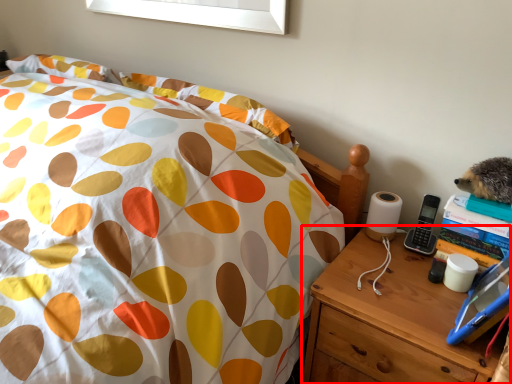
Question: Observing the image, what is the correct spatial positioning of nightstand (annotated by the red box) in reference to bed?

Choices:
 (A) right
 (B) left

Answer: (A)